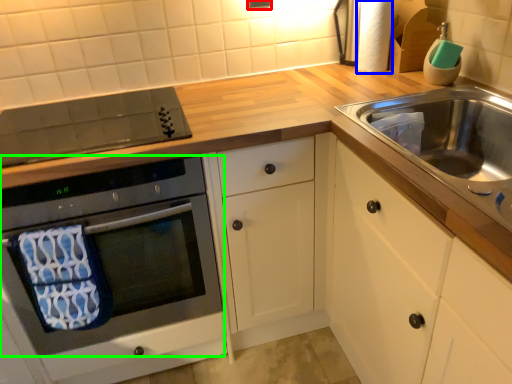
Question: Estimate the real-world distances between objects in this image. Which object is closer to electric outlet (highlighted by a red box), toilet paper (highlighted by a blue box) or oven (highlighted by a green box)?

Choices:
 (A) toilet paper
 (B) oven

Answer: (A)